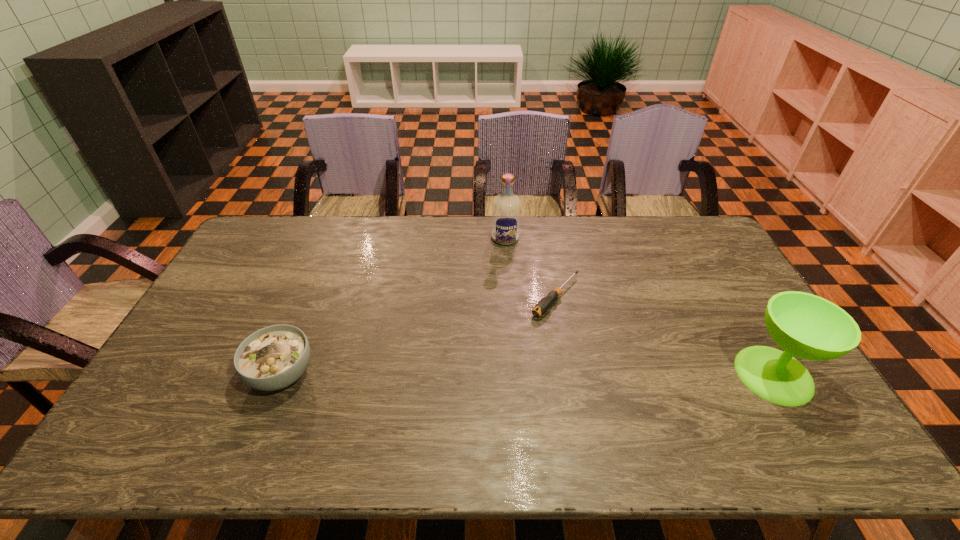
Where is `vacant spot on the desktop that is between the soup bowl and the rightmost object and is positioned on the label of the tallest object`? This screenshot has width=960, height=540. vacant spot on the desktop that is between the soup bowl and the rightmost object and is positioned on the label of the tallest object is located at coordinates (510, 374).

At what (x,y) coordinates should I click in order to perform the action: click on vacant space on the desktop that is between the second shortest object and the wineglass and is positioned at the tip of the screwdriver. Please return your answer as a coordinate pair (x, y). This screenshot has height=540, width=960. Looking at the image, I should click on (480, 374).